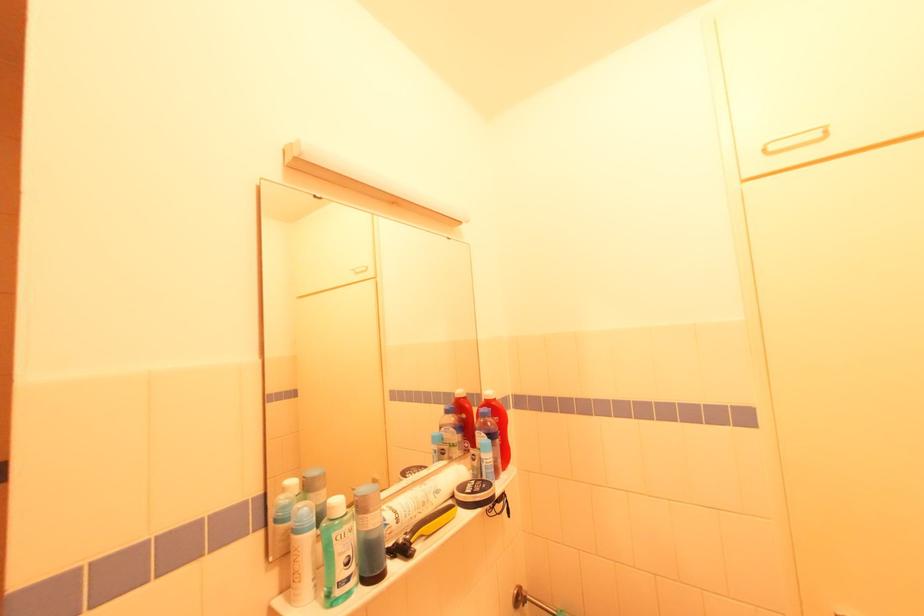
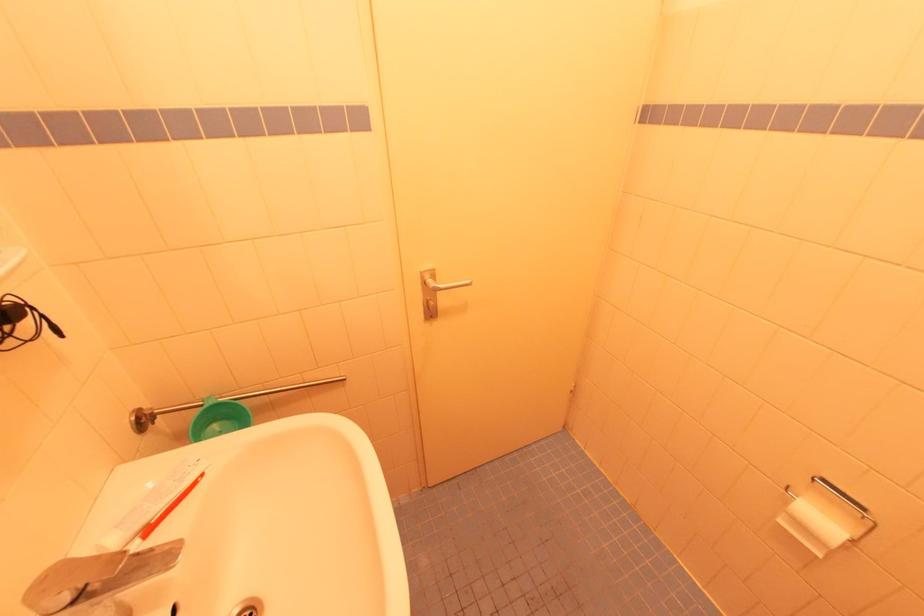
The first image is from the beginning of the video and the second image is from the end. How did the camera likely rotate when shooting the video?

The camera rotated toward right-down.